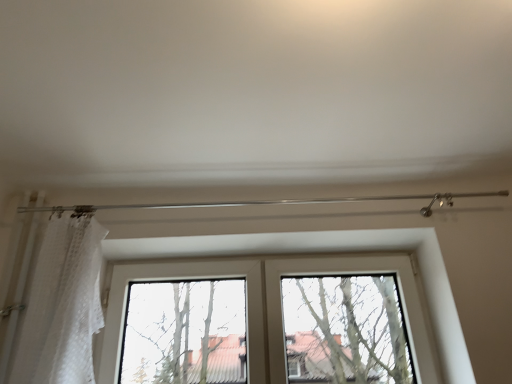
Question: Does white lace curtain at left have a smaller size compared to bare branches at center?

Choices:
 (A) yes
 (B) no

Answer: (A)

Question: Can you confirm if white lace curtain at left is taller than bare branches at center?

Choices:
 (A) no
 (B) yes

Answer: (B)

Question: From the image's perspective, is white lace curtain at left located beneath bare branches at center?

Choices:
 (A) no
 (B) yes

Answer: (A)

Question: Is the position of white lace curtain at left less distant than that of bare branches at center?

Choices:
 (A) yes
 (B) no

Answer: (A)

Question: Is bare branches at center surrounded by white lace curtain at left?

Choices:
 (A) no
 (B) yes

Answer: (A)

Question: Is bare branches at center at the back of white lace curtain at left?

Choices:
 (A) no
 (B) yes

Answer: (A)

Question: Is white lace curtain at left far from clear glass window at center?

Choices:
 (A) no
 (B) yes

Answer: (A)

Question: Is white lace curtain at left to the left of clear glass window at center from the viewer's perspective?

Choices:
 (A) yes
 (B) no

Answer: (A)

Question: Does white lace curtain at left have a greater width compared to clear glass window at center?

Choices:
 (A) no
 (B) yes

Answer: (B)

Question: Can you confirm if white lace curtain at left is thinner than clear glass window at center?

Choices:
 (A) no
 (B) yes

Answer: (A)

Question: Is white lace curtain at left bigger than clear glass window at center?

Choices:
 (A) no
 (B) yes

Answer: (A)

Question: Would you say clear glass window at center is part of white lace curtain at left's contents?

Choices:
 (A) yes
 (B) no

Answer: (B)

Question: Are bare branches at center and white lace curtain at left far apart?

Choices:
 (A) yes
 (B) no

Answer: (A)